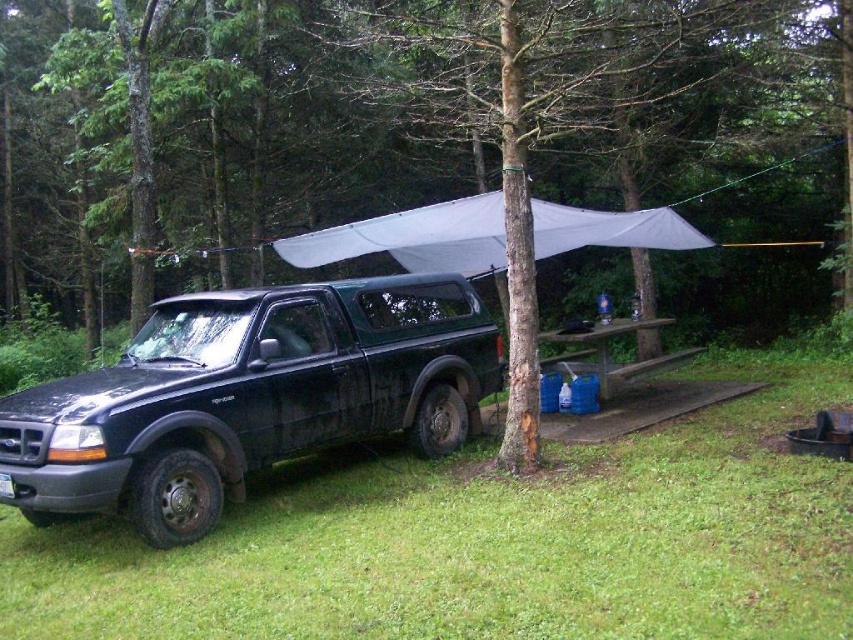
You are planning to set up a tent in the camping area shown. The tent requires a flat space of at least 20 feet between the green grass at lower left and the white fabric canopy at center. Can you determine if the available space between them is sufficient?

The distance between the green grass at lower left and the white fabric canopy at center is 22.98 feet, which is more than the required 20 feet. Therefore, the space is sufficient for setting up the tent.

You are setting up a campsite and need to place a tent between the green bark tree at center and the green grass at lower left. According to the scene, which object should the tent be closer to?

The green bark tree at center is positioned on the left side of green grass at lower left, so the tent should be placed closer to the green grass at lower left to maintain the spatial arrangement.

You are planning to set up a tent in the camping area. The tent requires a space where the green bark tree at center and the white fabric canopy at center are not blocking it. Based on their sizes, which object would you need to consider more when choosing the tent location?

The green bark tree at center is bigger than the white fabric canopy at center, so you need to consider the green bark tree at center more when choosing the tent location to ensure it doesn not block the space.